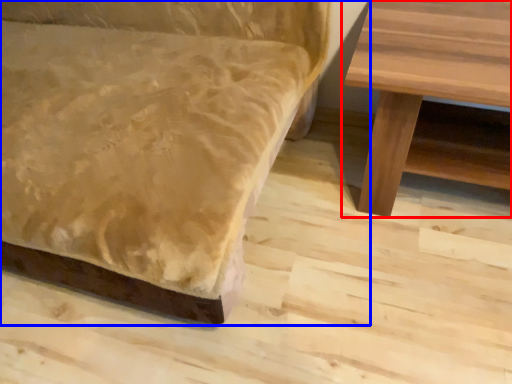
Question: Which object appears closest to the camera in this image, table (highlighted by a red box) or studio couch (highlighted by a blue box)?

Choices:
 (A) table
 (B) studio couch

Answer: (B)